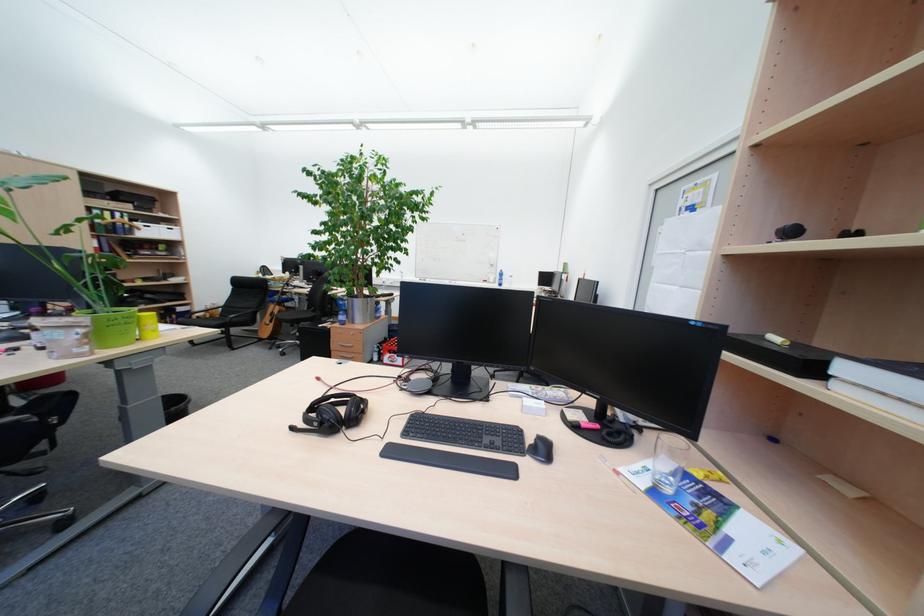
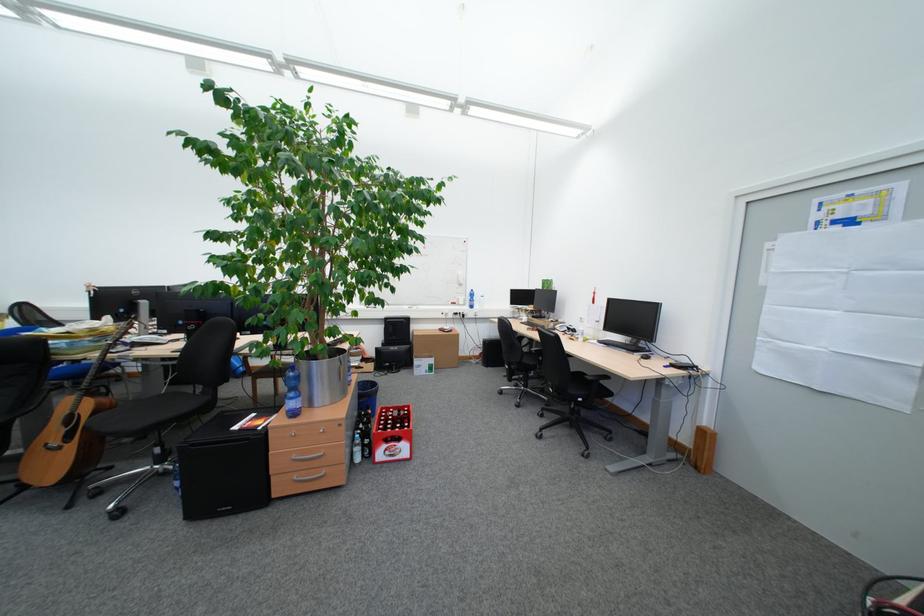
The point at (308, 294) is marked in the first image. Where is the corresponding point in the second image?

(150, 360)